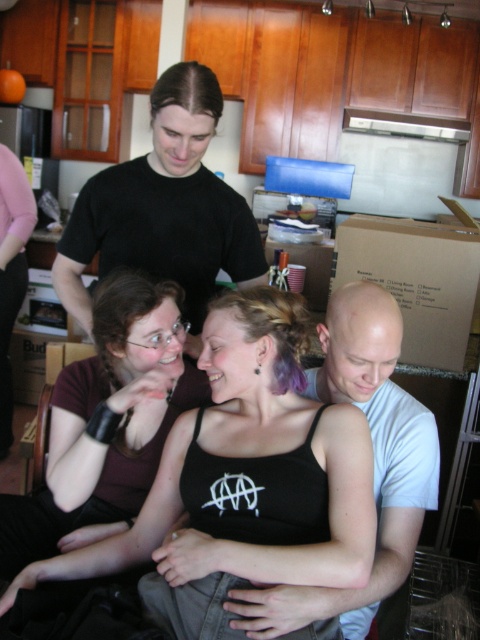
Question: Which of the following is the closest to the observer?

Choices:
 (A) tap(33, 586)
 (B) tap(14, 531)
 (C) tap(355, 385)

Answer: (A)

Question: Among these points, which one is nearest to the camera?

Choices:
 (A) (192, 177)
 (B) (325, 410)

Answer: (B)

Question: Does black tank top at center have a larger size compared to matte black tank top at center?

Choices:
 (A) no
 (B) yes

Answer: (B)

Question: Which point appears farthest from the camera in this image?

Choices:
 (A) (173, 118)
 (B) (310, 513)

Answer: (A)

Question: Is black matte shirt at upper center further to the viewer compared to bald head at center?

Choices:
 (A) no
 (B) yes

Answer: (B)

Question: Is matte black tank top at center wider than bald head at center?

Choices:
 (A) no
 (B) yes

Answer: (B)